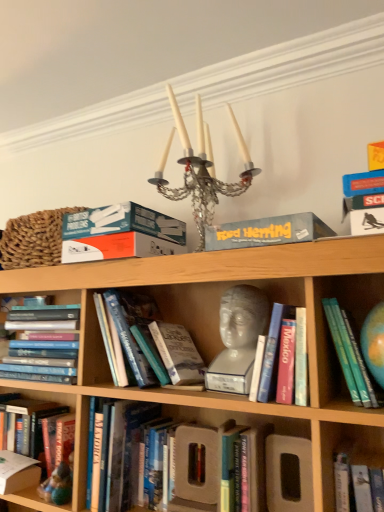
Question: From a real-world perspective, does teal hardcover book at right, arranged as the 1th book when viewed from the right, sit lower than white marble bust at center?

Choices:
 (A) no
 (B) yes

Answer: (B)

Question: Is white marble bust at center inside teal hardcover book at right, arranged as the 1th book when viewed from the right?

Choices:
 (A) no
 (B) yes

Answer: (A)

Question: Does teal hardcover book at right, arranged as the 1th book when viewed from the right, appear on the right side of white marble bust at center?

Choices:
 (A) yes
 (B) no

Answer: (A)

Question: Considering the relative positions of teal hardcover book at right, arranged as the 1th book when viewed from the right, and white marble bust at center in the image provided, is teal hardcover book at right, arranged as the 1th book when viewed from the right, to the left of white marble bust at center from the viewer's perspective?

Choices:
 (A) yes
 (B) no

Answer: (B)

Question: Considering the relative sizes of teal hardcover book at right, arranged as the 1th book when viewed from the right, and white marble bust at center in the image provided, is teal hardcover book at right, arranged as the 1th book when viewed from the right, thinner than white marble bust at center?

Choices:
 (A) no
 (B) yes

Answer: (A)

Question: Considering the relative sizes of teal hardcover book at right, the 5th book in the left-to-right sequence, and white marble bust at center in the image provided, is teal hardcover book at right, the 5th book in the left-to-right sequence, smaller than white marble bust at center?

Choices:
 (A) yes
 (B) no

Answer: (A)

Question: Can you confirm if crystal glass candle holder at upper center is wider than braided straw basket at upper left?

Choices:
 (A) yes
 (B) no

Answer: (A)

Question: Is crystal glass candle holder at upper center positioned before braided straw basket at upper left?

Choices:
 (A) no
 (B) yes

Answer: (B)

Question: From the image's perspective, is crystal glass candle holder at upper center located above braided straw basket at upper left?

Choices:
 (A) no
 (B) yes

Answer: (B)

Question: Is crystal glass candle holder at upper center not close to braided straw basket at upper left?

Choices:
 (A) no
 (B) yes

Answer: (A)

Question: Is crystal glass candle holder at upper center thinner than braided straw basket at upper left?

Choices:
 (A) no
 (B) yes

Answer: (A)

Question: Is crystal glass candle holder at upper center with braided straw basket at upper left?

Choices:
 (A) yes
 (B) no

Answer: (B)

Question: Is hardcover book at lower left, which is the fifth book from right to left, further to the viewer compared to braided straw basket at upper left?

Choices:
 (A) yes
 (B) no

Answer: (A)